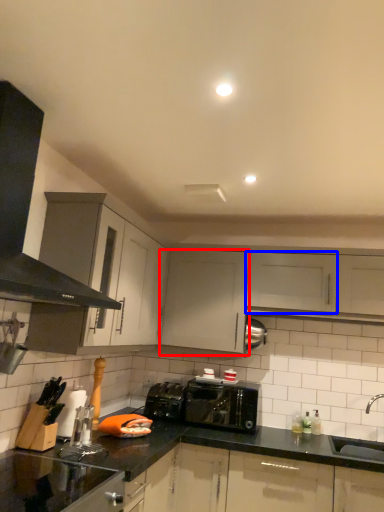
Question: Which object appears closest to the camera in this image, cabinetry (highlighted by a red box) or cabinetry (highlighted by a blue box)?

Choices:
 (A) cabinetry
 (B) cabinetry

Answer: (B)